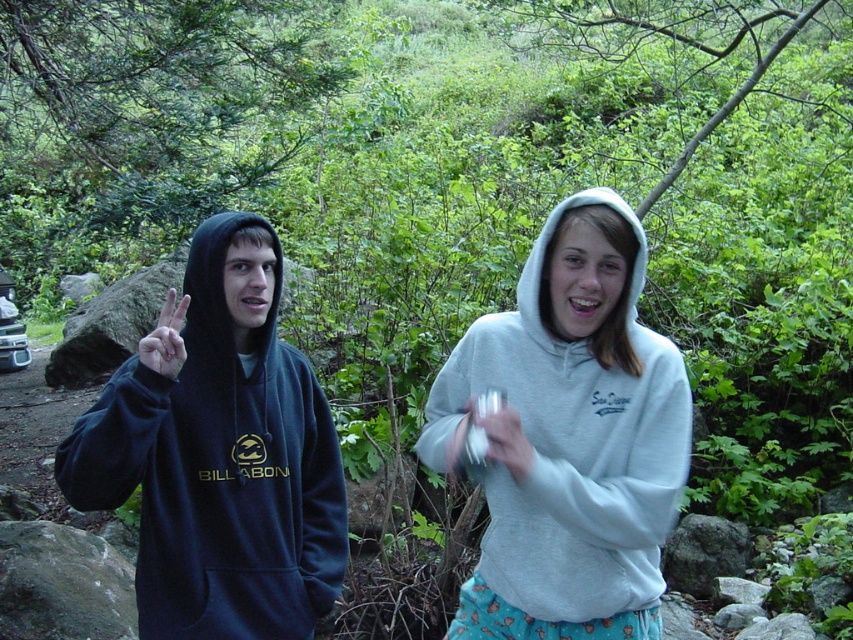
You are a photographer trying to capture a photo of the dark blue fleece hoodie at left and the white matte hand at center. If you want to ensure both subjects are in focus, which one should you adjust your camera focus to prioritize based on their sizes?

The dark blue fleece hoodie at left is wider than the white matte hand at center, so you should prioritize focusing on the dark blue fleece hoodie at left since it is larger and requires more detailed focus to ensure clarity.

You are a photographer trying to capture a candid shot of the dark blue fleece hoodie at left. Your camera is 6.34 feet away from the hoodie. Is this distance within the minimum focusing distance of most standard cameras? Please explain.

Most standard cameras have a minimum focusing distance of about 1 to 3 feet. Since the dark blue fleece hoodie at left is 6.34 feet away from the camera, which is beyond the minimum focusing distance, the camera should be able to focus on it easily.